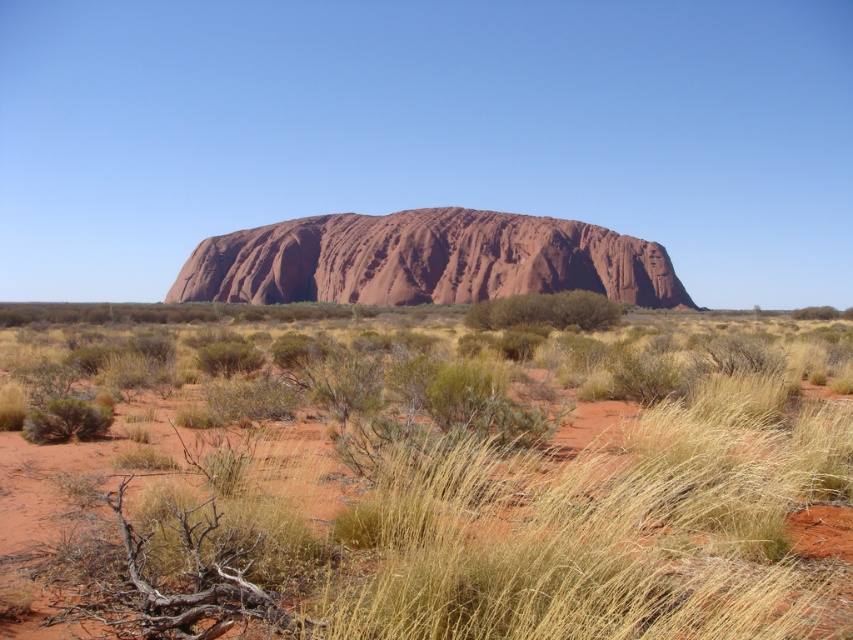
Question: Which object appears farthest from the camera in this image?

Choices:
 (A) yellow dry grass at center
 (B) green shrub at center

Answer: (B)

Question: Does yellow dry grass at center have a smaller size compared to reddish-brown rock at center?

Choices:
 (A) yes
 (B) no

Answer: (A)

Question: Which of the following is the closest to the observer?

Choices:
 (A) (352, 284)
 (B) (477, 316)
 (C) (610, 627)

Answer: (C)

Question: Can you confirm if reddish-brown rock at center is positioned above green shrub at center?

Choices:
 (A) no
 (B) yes

Answer: (B)

Question: Which of the following is the closest to the observer?

Choices:
 (A) green shrub at center
 (B) reddish-brown rock at center

Answer: (A)

Question: Can you confirm if yellow dry grass at center is positioned to the left of reddish-brown rock at center?

Choices:
 (A) no
 (B) yes

Answer: (A)